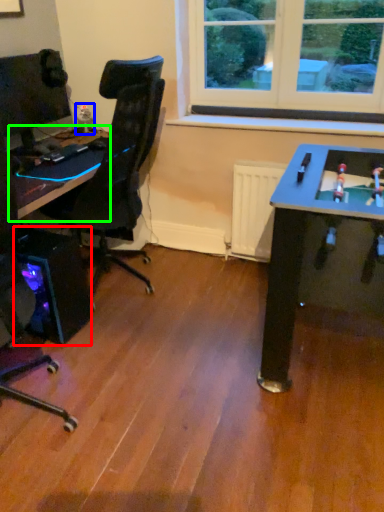
Question: Which is farther away from computer tower (highlighted by a red box)? toy (highlighted by a blue box) or table (highlighted by a green box)?

Choices:
 (A) toy
 (B) table

Answer: (A)